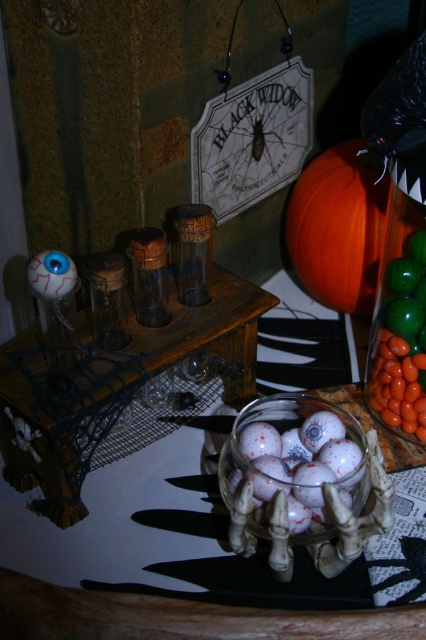
Question: Estimate the real-world distances between objects in this image. Which object is closer to the translucent glass table at center?

Choices:
 (A) orange matte pumpkin at upper right
 (B) translucent glass candy at right

Answer: (B)

Question: Which object is closer to the camera taking this photo?

Choices:
 (A) translucent glass table at center
 (B) orange matte pumpkin at upper right
 (C) translucent glass candy at right

Answer: (A)

Question: Which point is closer to the camera?

Choices:
 (A) (112, 625)
 (B) (333, 240)
 (C) (414, 374)

Answer: (A)

Question: Does orange matte pumpkin at upper right have a larger size compared to translucent glass candy at right?

Choices:
 (A) no
 (B) yes

Answer: (B)

Question: In this image, where is translucent glass table at center located relative to orange matte pumpkin at upper right?

Choices:
 (A) below
 (B) above

Answer: (A)

Question: Does translucent glass table at center lie behind translucent glass candy at right?

Choices:
 (A) no
 (B) yes

Answer: (A)